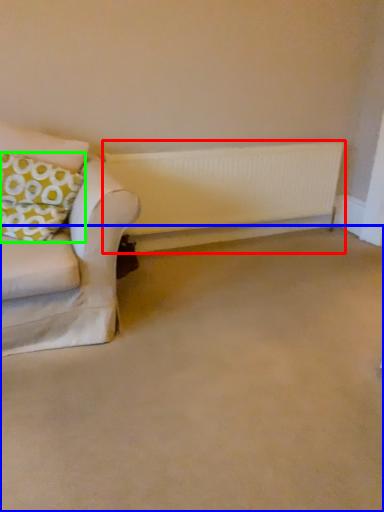
Question: Based on their relative distances, which object is nearer to radiator (highlighted by a red box)? Choose from plain (highlighted by a blue box) and pillow (highlighted by a green box).

Choices:
 (A) plain
 (B) pillow

Answer: (B)